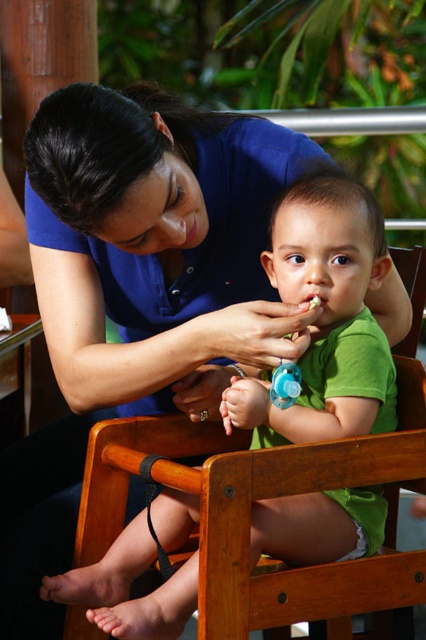
Question: Can you confirm if green matte shirt at center is thinner than blue rubber teething ring at center?

Choices:
 (A) yes
 (B) no

Answer: (B)

Question: Which object is farther from the camera taking this photo?

Choices:
 (A) green matte shirt at center
 (B) blue rubber teething ring at center

Answer: (B)

Question: Which of the following is the farthest from the observer?

Choices:
 (A) (276, 403)
 (B) (204, 412)

Answer: (B)

Question: Can you confirm if blue rubber sippy cup at center is smaller than blue rubber teething ring at center?

Choices:
 (A) yes
 (B) no

Answer: (B)

Question: Does blue rubber sippy cup at center appear under blue rubber teething ring at center?

Choices:
 (A) yes
 (B) no

Answer: (B)

Question: Which point is closer to the camera taking this photo?

Choices:
 (A) (307, 257)
 (B) (268, 390)

Answer: (B)